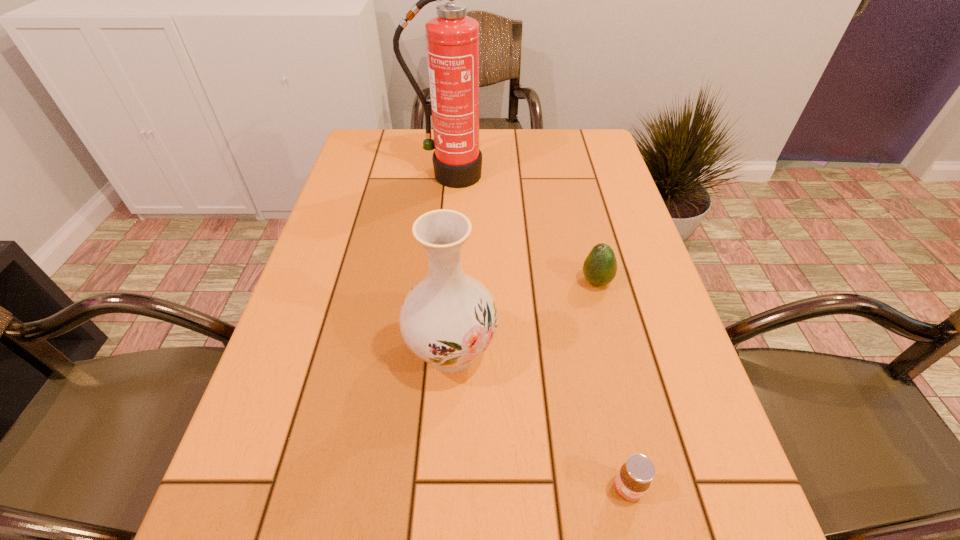
You are a GUI agent. You are given a task and a screenshot of the screen. Output one action in this format:
    pyautogui.click(x=<x>, y=<y>)
    Task: Click on the blank area located on the front of the avocado
    Image resolution: width=960 pixels, height=540 pixels.
    Given the screenshot: What is the action you would take?
    pyautogui.click(x=634, y=431)

Identify the location of object that is at the far edge. [x=452, y=39].

Locate an element on the screen. avocado present at the right edge is located at coordinates (600, 267).

In order to click on jam present at the right edge in this screenshot , I will do `click(634, 478)`.

This screenshot has height=540, width=960. Identify the location of vacant region at the far edge. (410, 139).

Where is `free region at the left edge`? free region at the left edge is located at coordinates (301, 353).

Identify the location of vacant space at the right edge of the desktop. (615, 215).

The width and height of the screenshot is (960, 540). In the image, there is a desktop. In order to click on vacant space at the far right corner in this screenshot , I will do `click(554, 148)`.

You are a GUI agent. You are given a task and a screenshot of the screen. Output one action in this format:
    pyautogui.click(x=<x>, y=<y>)
    Task: Click on the empty location between the nearest object and the farthest object
    
    Given the screenshot: What is the action you would take?
    pyautogui.click(x=539, y=332)

Find the location of a particular element. The image size is (960, 540). free spot between the shortest object and the second farthest object is located at coordinates (612, 385).